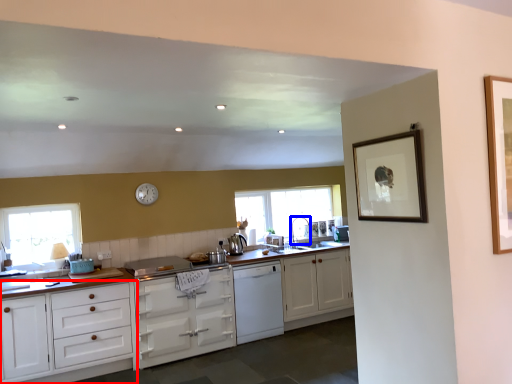
Question: Which point is closer to the camera, cabinetry (highlighted by a red box) or faucet (highlighted by a blue box)?

Choices:
 (A) cabinetry
 (B) faucet

Answer: (A)